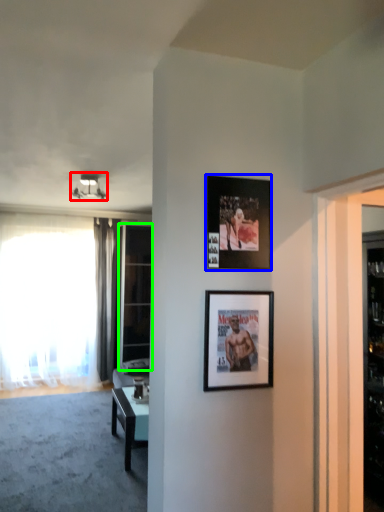
Question: Which object is the farthest from light fixture (highlighted by a red box)? Choose among these: picture frame (highlighted by a blue box) or glass door (highlighted by a green box).

Choices:
 (A) picture frame
 (B) glass door

Answer: (A)